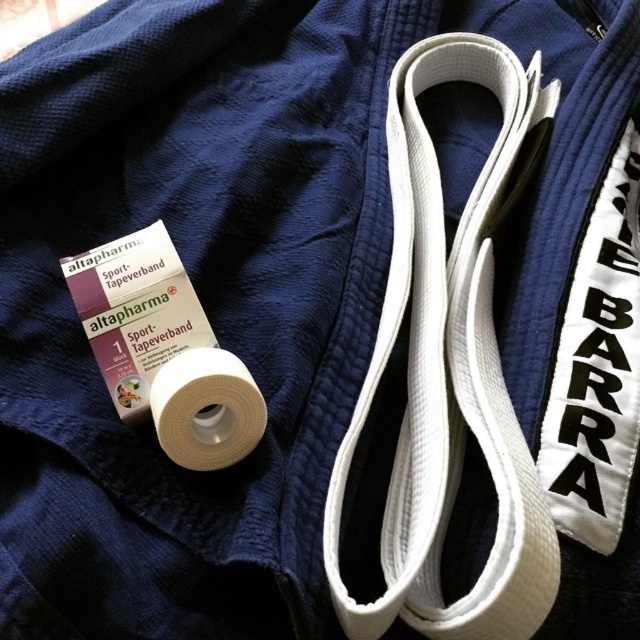
Who is positioned more to the left, white fabric strap at center or white matte tape at lower left?

white matte tape at lower left

Identify the location of white fabric strap at center. The height and width of the screenshot is (640, 640). (449, 372).

Find the location of a particular element. This screenshot has width=640, height=640. white fabric strap at center is located at coordinates (449, 372).